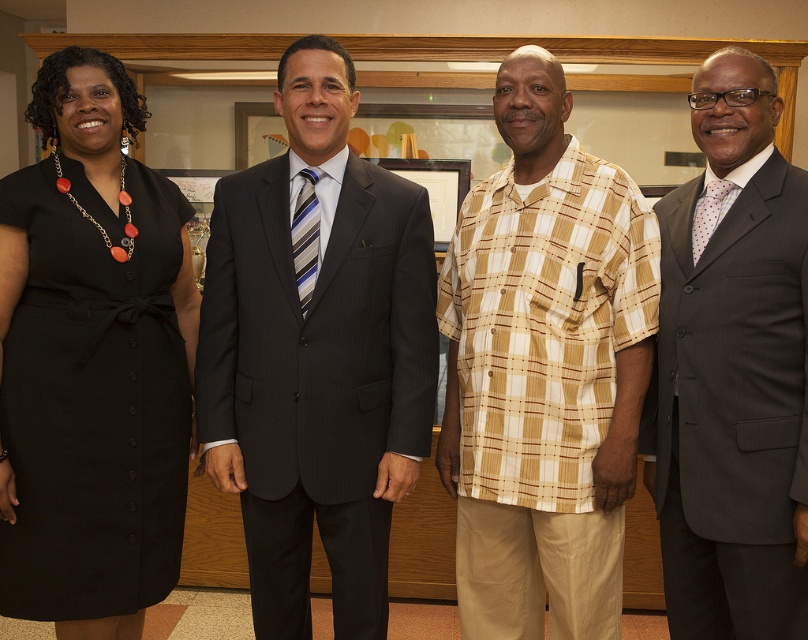
You are organizing a photo shoot and need to know the relative sizes of the beige plaid shirt at center and the gray suit at right. Which one has a larger size?

The beige plaid shirt at center is bigger than the gray suit at right.

You are standing in front of the group of four people in the image. You want to touch the point at coordinates point (310, 108) and the point at coordinates point (713, 220). Which point will require you to reach further back?

The point at coordinates point (713, 220) will require you to reach further back because it is farther from the camera compared to point (310, 108).